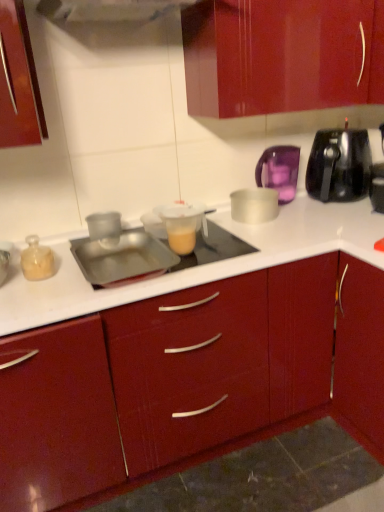
Question: Is silver metallic bowl at center, which appears as the 3th kitchen appliance when viewed from the right, in front of or behind black plastic toaster at upper right, the 1th kitchen appliance positioned from the right, in the image?

Choices:
 (A) front
 (B) behind

Answer: (A)

Question: In the image, is silver metallic bowl at center, positioned as the 3th kitchen appliance in left-to-right order, on the left side or the right side of black plastic toaster at upper right, the 1th kitchen appliance positioned from the right?

Choices:
 (A) left
 (B) right

Answer: (A)

Question: Which object is positioned closest to the purple translucent kettle at upper right, the 4th kitchen appliance when ordered from left to right?

Choices:
 (A) translucent plastic measuring cup at center, which appears as the 2th appliance when viewed from the left
 (B) translucent glass jar at left, the 5th kitchen appliance positioned from the right
 (C) transparent plastic cup at center, acting as the 2th kitchen appliance starting from the left
 (D) silver metallic bowl at center, positioned as the 3th kitchen appliance in left-to-right order
 (E) glossy wood cabinet at center

Answer: (D)

Question: Estimate the real-world distances between objects in this image. Which object is closer to the silver metallic bowl at center, positioned as the 3th kitchen appliance in left-to-right order?

Choices:
 (A) translucent glass jar at left, the 5th kitchen appliance positioned from the right
 (B) glossy wood cabinet at center
 (C) purple translucent kettle at upper right, the 4th kitchen appliance when ordered from left to right
 (D) transparent plastic cup at center, acting as the 2th kitchen appliance starting from the left
 (E) metallic silver tray at center, marked as the 1th appliance in a left-to-right arrangement

Answer: (C)